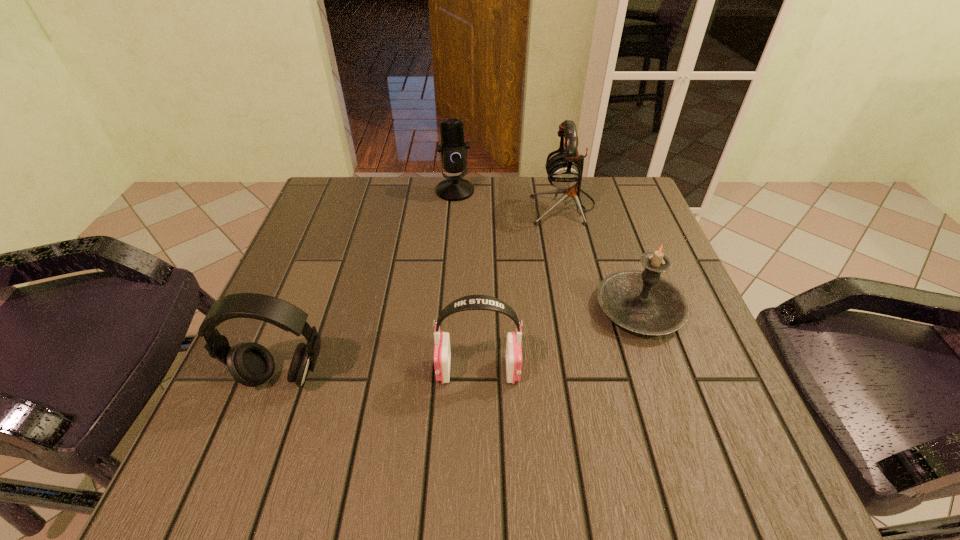
What are the coordinates of `free spot located 0.200m on the back of the third farthest object` in the screenshot? It's located at click(x=610, y=223).

Where is `earphone at the far edge`? This screenshot has width=960, height=540. earphone at the far edge is located at coordinates (564, 169).

This screenshot has height=540, width=960. Find the location of `microphone at the far edge`. microphone at the far edge is located at coordinates (453, 150).

In order to click on object that is at the left edge in this screenshot , I will do `click(251, 364)`.

Locate an element on the screen. earphone that is at the right edge is located at coordinates (564, 169).

You are a GUI agent. You are given a task and a screenshot of the screen. Output one action in this format:
    pyautogui.click(x=<x>, y=<y>)
    Task: Click on the candle present at the right edge
    The height and width of the screenshot is (540, 960).
    Given the screenshot: What is the action you would take?
    pyautogui.click(x=643, y=302)

Image resolution: width=960 pixels, height=540 pixels. In order to click on object present at the far right corner in this screenshot , I will do `click(564, 169)`.

In the image, there is a desktop. Identify the location of vacant space at the far edge. (435, 211).

Find the location of `vacant position at the near edge of the desktop`. vacant position at the near edge of the desktop is located at coordinates (522, 481).

Where is `vacant space at the left edge of the desktop`? This screenshot has width=960, height=540. vacant space at the left edge of the desktop is located at coordinates (251, 335).